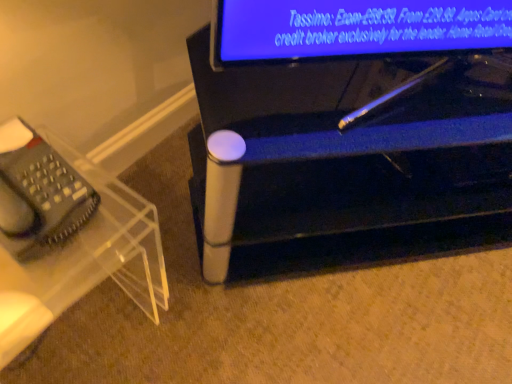
Question: From the image's perspective, does metallic silver pen at lower center, marked as the second furniture in a left-to-right arrangement, appear lower than transparent acrylic phone stand at left, the 1th furniture in the left-to-right sequence?

Choices:
 (A) no
 (B) yes

Answer: (A)

Question: From a real-world perspective, is metallic silver pen at lower center, marked as the second furniture in a left-to-right arrangement, positioned over transparent acrylic phone stand at left, the 1th furniture in the left-to-right sequence, based on gravity?

Choices:
 (A) no
 (B) yes

Answer: (B)

Question: Considering the relative sizes of metallic silver pen at lower center, marked as the second furniture in a left-to-right arrangement, and transparent acrylic phone stand at left, arranged as the 2th furniture when viewed from the right, in the image provided, is metallic silver pen at lower center, marked as the second furniture in a left-to-right arrangement, bigger than transparent acrylic phone stand at left, arranged as the 2th furniture when viewed from the right,?

Choices:
 (A) yes
 (B) no

Answer: (A)

Question: Is metallic silver pen at lower center, the 1th furniture from the right, not close to transparent acrylic phone stand at left, the 1th furniture in the left-to-right sequence?

Choices:
 (A) yes
 (B) no

Answer: (B)

Question: Does metallic silver pen at lower center, the 1th furniture from the right, lie in front of transparent acrylic phone stand at left, arranged as the 2th furniture when viewed from the right?

Choices:
 (A) yes
 (B) no

Answer: (B)

Question: From the image's perspective, is metallic silver pen at lower center, marked as the second furniture in a left-to-right arrangement, over transparent acrylic phone stand at left, the 1th furniture in the left-to-right sequence?

Choices:
 (A) no
 (B) yes

Answer: (B)

Question: Is metallic silver pen at lower center, marked as the second furniture in a left-to-right arrangement, turned away from clear plastic telephone at left?

Choices:
 (A) yes
 (B) no

Answer: (B)

Question: Is clear plastic telephone at left located within metallic silver pen at lower center, marked as the second furniture in a left-to-right arrangement?

Choices:
 (A) no
 (B) yes

Answer: (A)

Question: From the image's perspective, does metallic silver pen at lower center, the 1th furniture from the right, appear higher than clear plastic telephone at left?

Choices:
 (A) yes
 (B) no

Answer: (A)

Question: Is metallic silver pen at lower center, marked as the second furniture in a left-to-right arrangement, positioned far away from clear plastic telephone at left?

Choices:
 (A) yes
 (B) no

Answer: (B)

Question: From a real-world perspective, is metallic silver pen at lower center, the 1th furniture from the right, below clear plastic telephone at left?

Choices:
 (A) no
 (B) yes

Answer: (B)

Question: Is metallic silver pen at lower center, marked as the second furniture in a left-to-right arrangement, next to clear plastic telephone at left?

Choices:
 (A) yes
 (B) no

Answer: (B)

Question: Does clear plastic telephone at left have a lesser width compared to metallic silver pen at lower center, marked as the second furniture in a left-to-right arrangement?

Choices:
 (A) no
 (B) yes

Answer: (B)